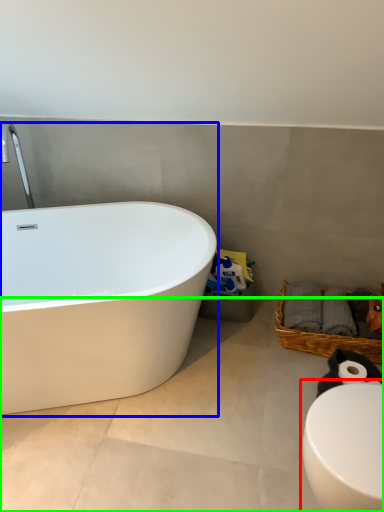
Question: Which is nearer to the toilet (highlighted by a red box)? bathtub (highlighted by a blue box) or concrete (highlighted by a green box).

Choices:
 (A) bathtub
 (B) concrete

Answer: (B)